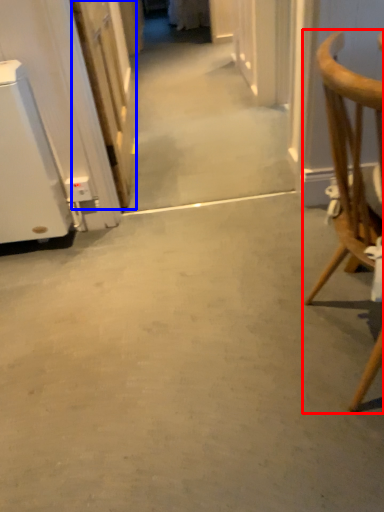
Question: Which object appears farthest to the camera in this image, chair (highlighted by a red box) or door (highlighted by a blue box)?

Choices:
 (A) chair
 (B) door

Answer: (B)